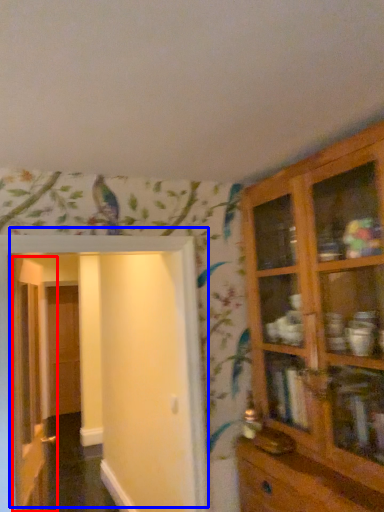
Question: Which object is closer to the camera taking this photo, door (highlighted by a red box) or door (highlighted by a blue box)?

Choices:
 (A) door
 (B) door

Answer: (B)